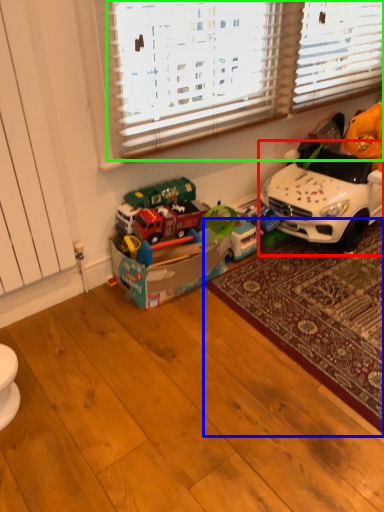
Question: Considering the real-world distances, which object is farthest from car (highlighted by a red box)? mat (highlighted by a blue box) or blind (highlighted by a green box)?

Choices:
 (A) mat
 (B) blind

Answer: (B)